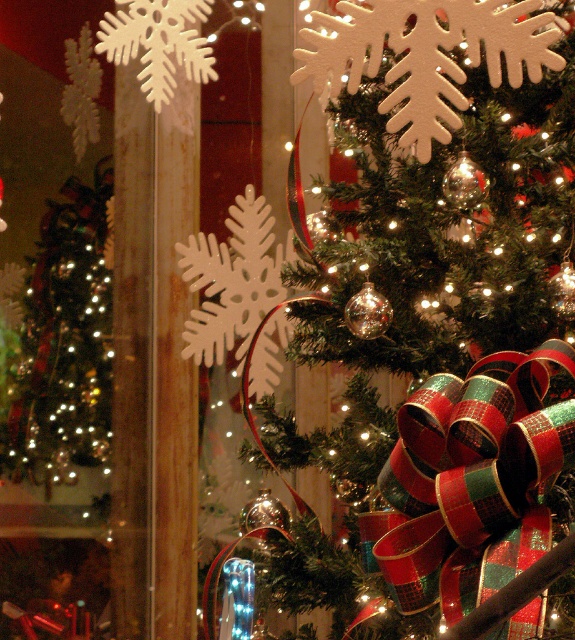
Consider the image. Does green matte christmas tree at center have a larger size compared to shiny gold ornaments at left?

Yes, green matte christmas tree at center is bigger than shiny gold ornaments at left.

Who is more forward, (x=396, y=44) or (x=102, y=260)?

Point (x=396, y=44) is more forward.

Which is in front, point (392, 88) or point (108, 406)?

Positioned in front is point (392, 88).

Find the location of a particular element. green matte christmas tree at center is located at coordinates (431, 324).